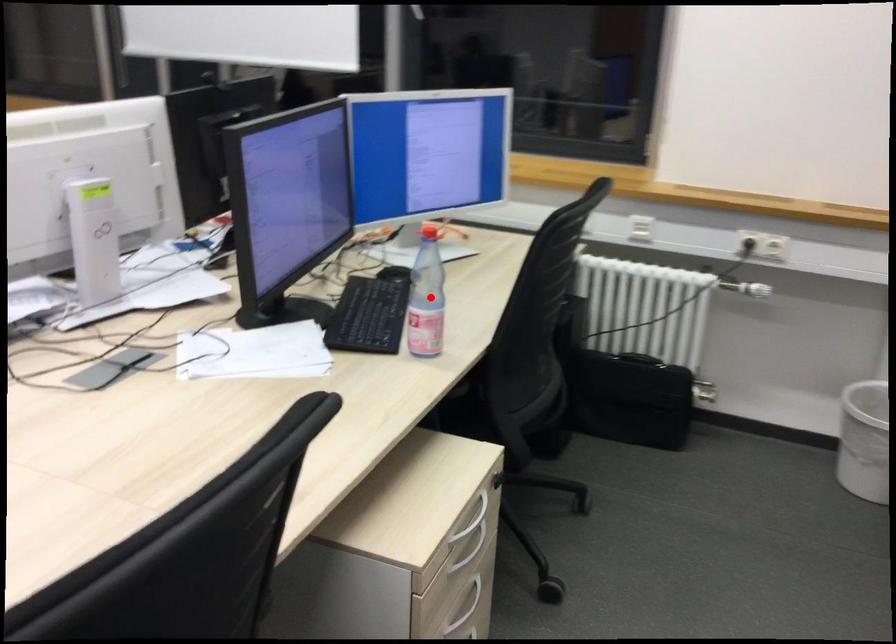
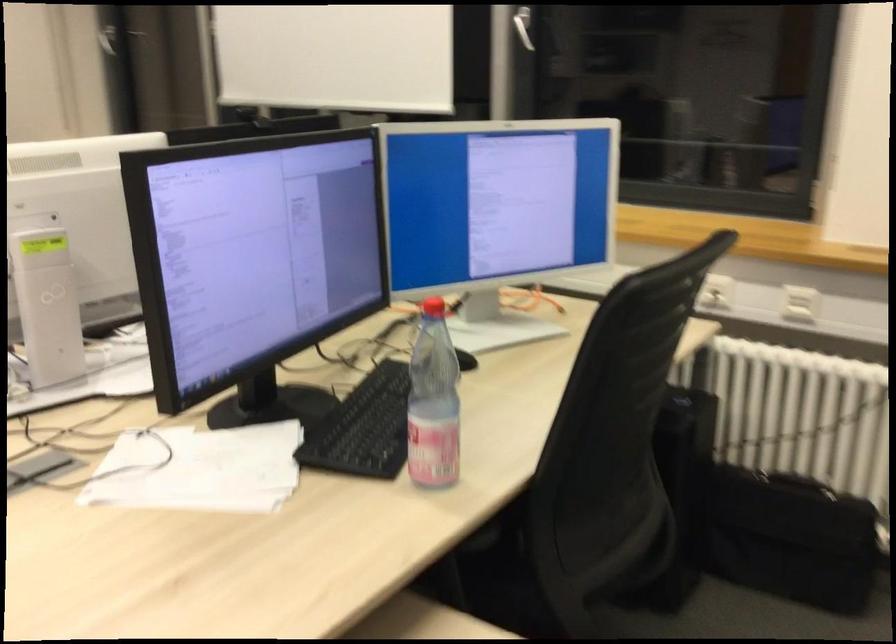
Locate, in the second image, the point that corresponds to the highlighted location in the first image.

(433, 402)